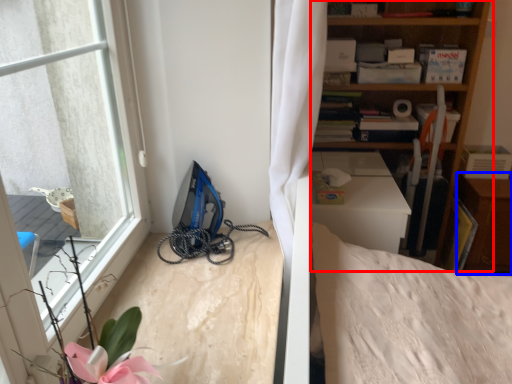
Question: Among these objects, which one is nearest to the camera, shelf (highlighted by a red box) or dresser (highlighted by a blue box)?

Choices:
 (A) shelf
 (B) dresser

Answer: (A)